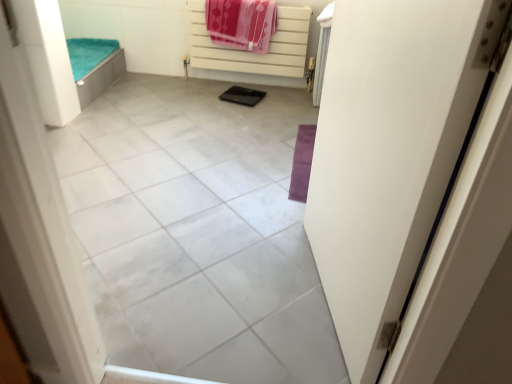
You are a GUI agent. You are given a task and a screenshot of the screen. Output one action in this format:
    pyautogui.click(x=<x>, y=<y>)
    Task: Click on the free region under white matte door at right (from a real-world perspective)
    
    Given the screenshot: What is the action you would take?
    pyautogui.click(x=320, y=291)